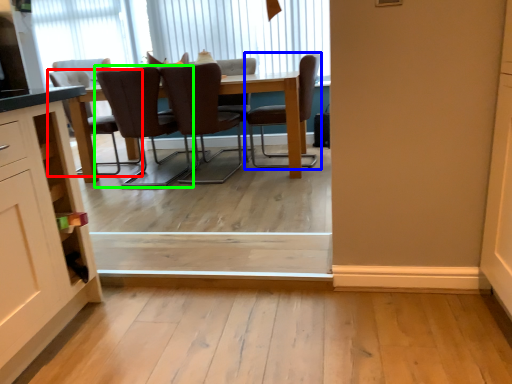
Question: Considering the real-world distances, which object is closest to chair (highlighted by a red box)? chair (highlighted by a blue box) or chair (highlighted by a green box).

Choices:
 (A) chair
 (B) chair

Answer: (B)